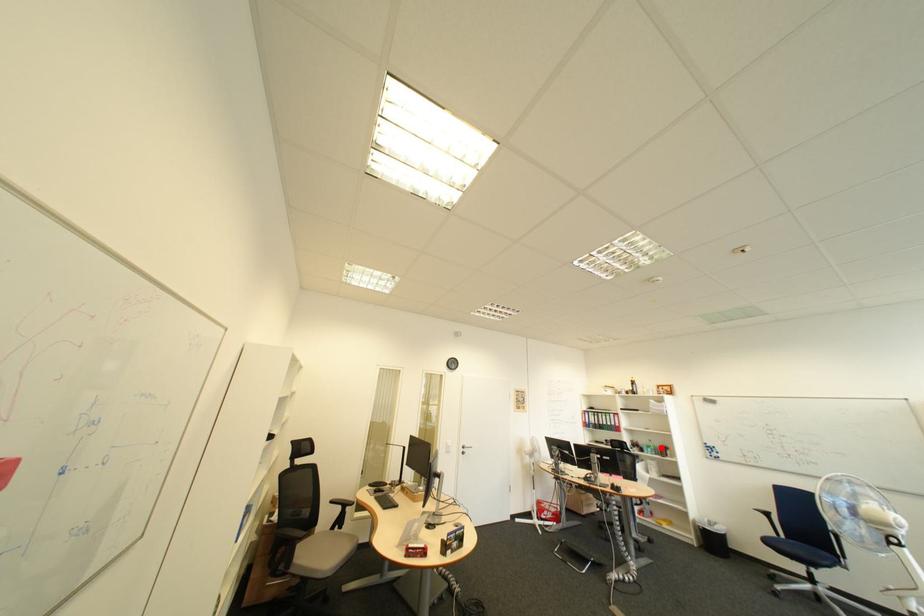
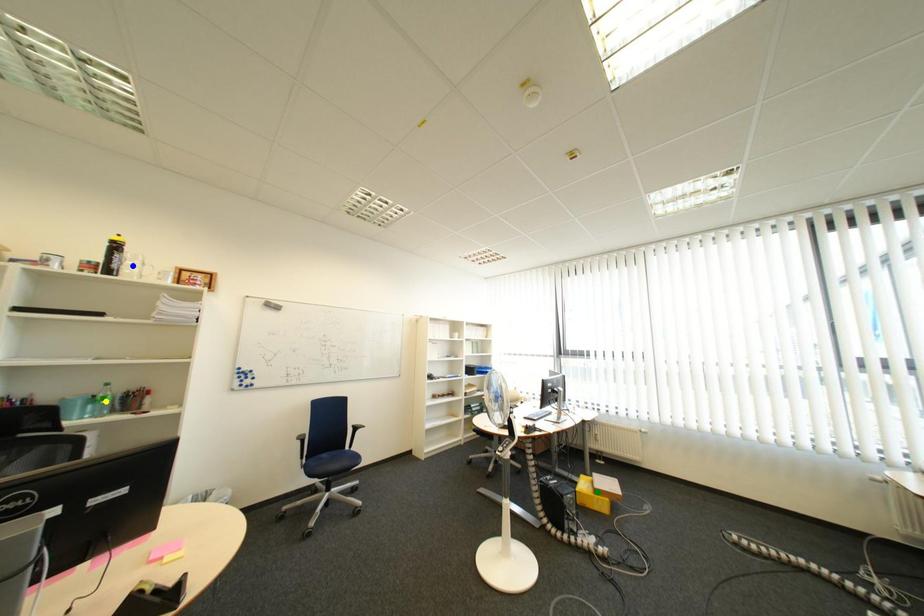
Question: I am providing you with two images of the same scene from different viewpoints. A red point is marked on the first image. You are given multiple points on the second image. Can you choose the point in image 2 that corresponds to the point in image 1?

Choices:
 (A) yellow point
 (B) blue point
 (C) green point

Answer: (A)